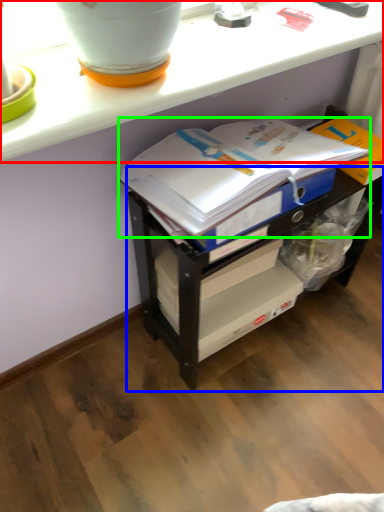
Question: Which object is positioned farthest from counter (highlighted by a red box)? Select from shelf (highlighted by a blue box) and journal (highlighted by a green box).

Choices:
 (A) shelf
 (B) journal

Answer: (A)